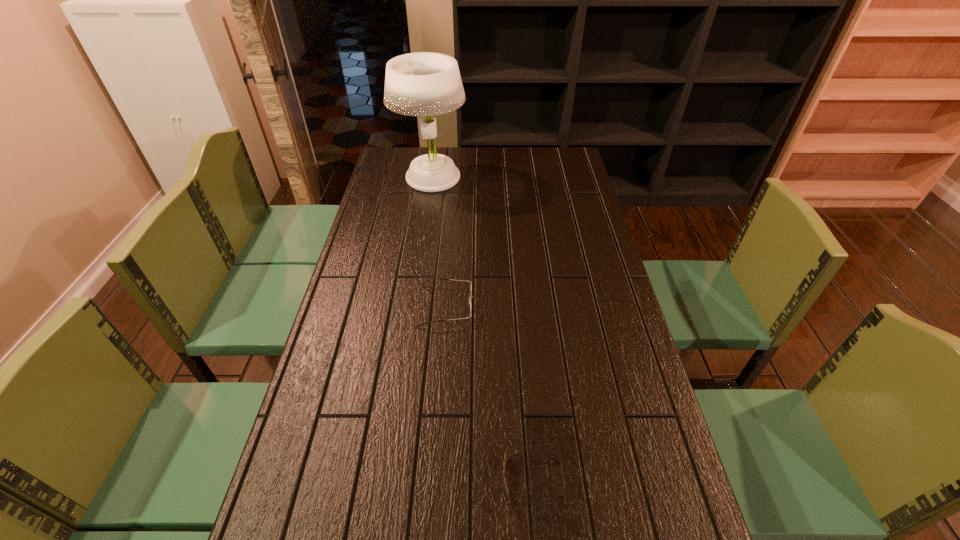
Where is `the farthest object`? Image resolution: width=960 pixels, height=540 pixels. the farthest object is located at coordinates (420, 84).

At what (x,y) coordinates should I click in order to perform the action: click on lamp. Please return your answer as a coordinate pair (x, y). Looking at the image, I should click on (420, 84).

The height and width of the screenshot is (540, 960). I want to click on the second shortest object, so click(471, 296).

I want to click on the second nearest object, so click(x=471, y=296).

At what (x,y) coordinates should I click in order to perform the action: click on the nearest object. Please return your answer as a coordinate pair (x, y). The width and height of the screenshot is (960, 540). Looking at the image, I should click on (505, 457).

Locate an element on the screen. The image size is (960, 540). the rightmost object is located at coordinates (505, 457).

This screenshot has height=540, width=960. In order to click on free location located 0.060m on the front-facing side of the lamp in this screenshot , I will do `click(427, 207)`.

You are a GUI agent. You are given a task and a screenshot of the screen. Output one action in this format:
    pyautogui.click(x=<x>, y=<y>)
    Task: Click on the free location located through the lenses of the second shortest object
    The image size is (960, 540).
    Given the screenshot: What is the action you would take?
    pyautogui.click(x=542, y=306)

Find the location of a particular element. vacant space located 0.070m on the front-facing side of the shortest object is located at coordinates (470, 480).

The width and height of the screenshot is (960, 540). I want to click on free space located on the front-facing side of the shortest object, so click(x=406, y=480).